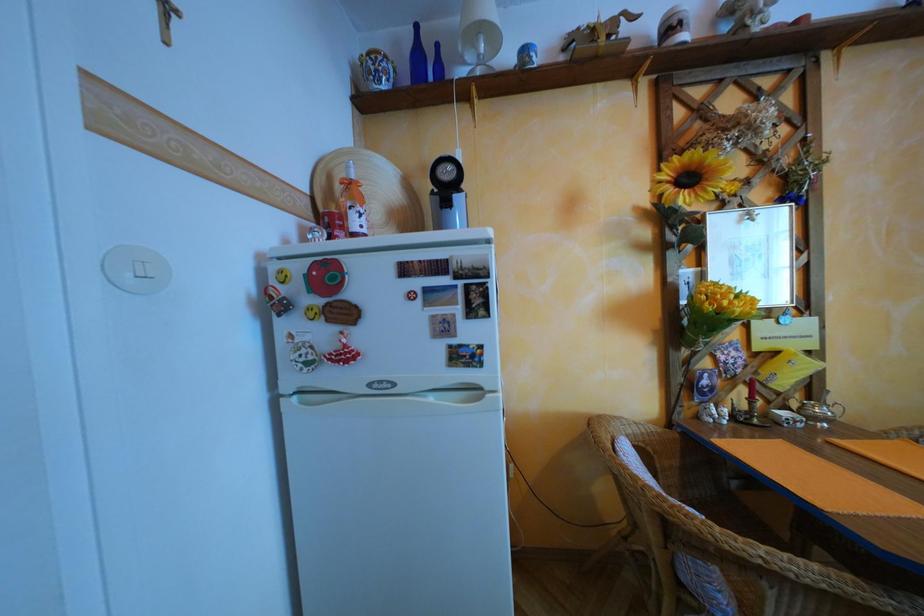
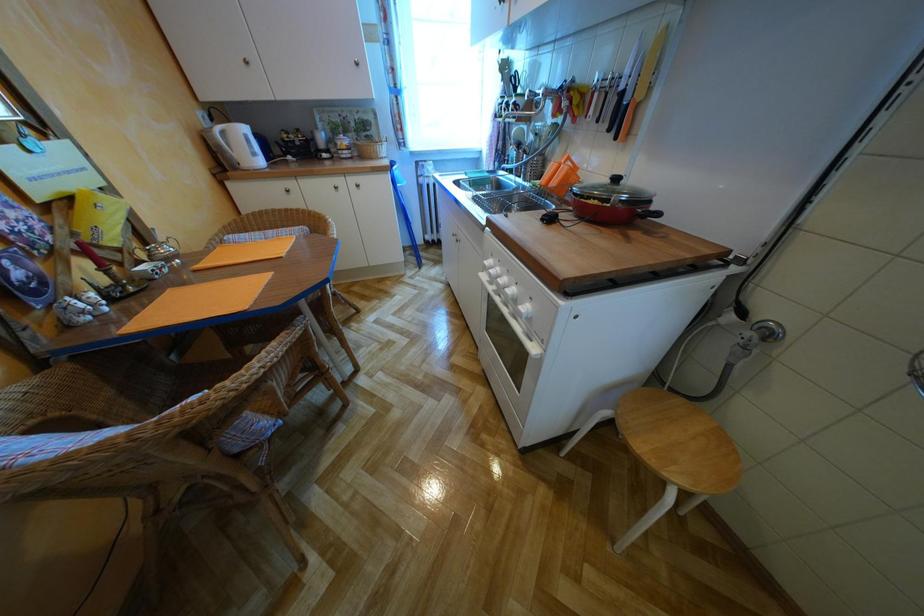
Based on the continuous images, in which direction is the camera rotating?

The camera rotated toward right-down.